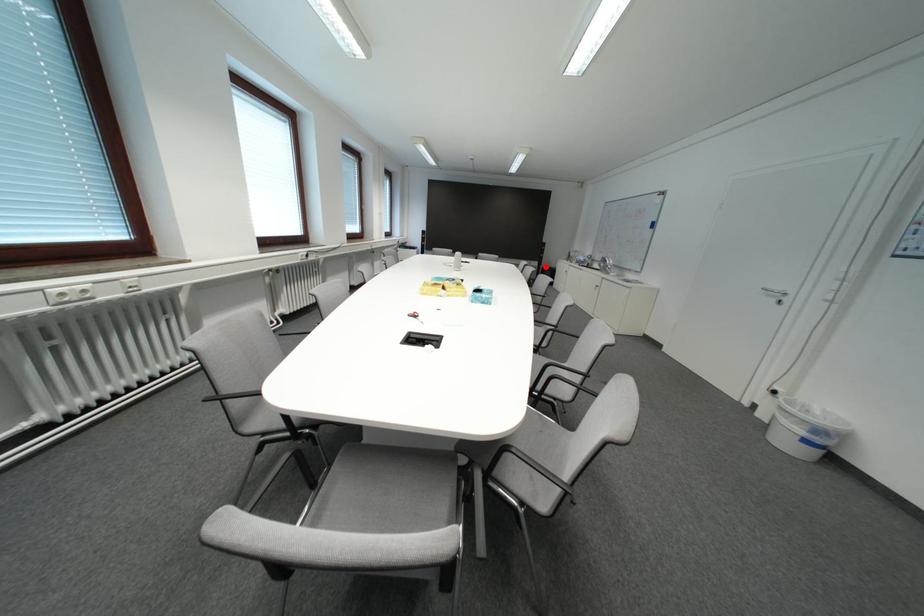
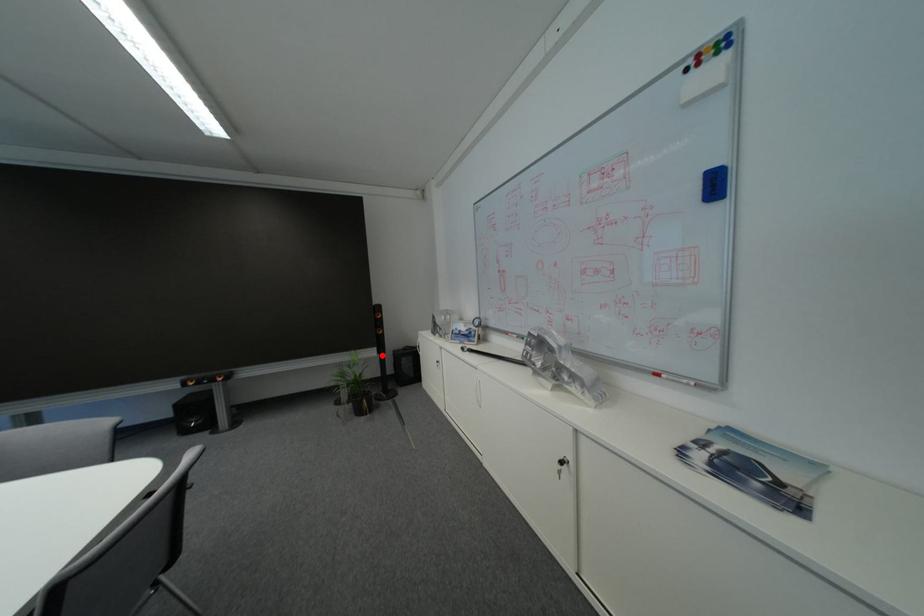
I am providing you with two images of the same scene from different viewpoints. A red point is marked on the first image and another point is marked on the second image. Do the highlighted points in image1 and image2 indicate the same real-world spot?

Yes